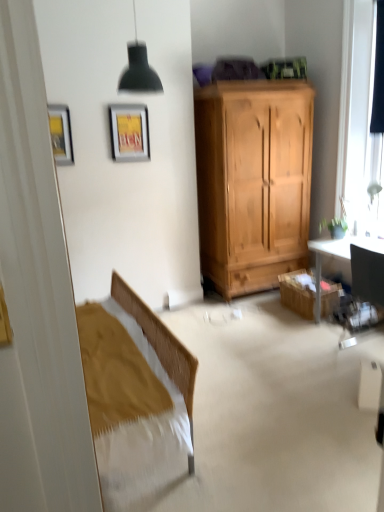
Question: Is wooden cabinet at lower right shorter than black fabric curtain at right?

Choices:
 (A) no
 (B) yes

Answer: (B)

Question: Can you confirm if wooden cabinet at lower right is positioned to the left of black fabric curtain at right?

Choices:
 (A) no
 (B) yes

Answer: (B)

Question: Is black fabric curtain at right located within wooden cabinet at lower right?

Choices:
 (A) no
 (B) yes

Answer: (A)

Question: Does wooden cabinet at lower right have a lesser width compared to black fabric curtain at right?

Choices:
 (A) no
 (B) yes

Answer: (A)

Question: Is wooden cabinet at lower right closer to camera compared to black fabric curtain at right?

Choices:
 (A) yes
 (B) no

Answer: (B)

Question: Choose the correct answer: Is matte black lampshade at upper center inside metallic silver picture frame at upper center, which appears as the second picture frame when viewed from the left, or outside it?

Choices:
 (A) inside
 (B) outside

Answer: (B)

Question: Considering the positions of point (153, 91) and point (135, 155), is point (153, 91) closer or farther from the camera than point (135, 155)?

Choices:
 (A) farther
 (B) closer

Answer: (B)

Question: From a real-world perspective, is matte black lampshade at upper center above or below metallic silver picture frame at upper center, which is the second picture frame from front to back?

Choices:
 (A) below
 (B) above

Answer: (B)

Question: Based on their sizes in the image, would you say matte black lampshade at upper center is bigger or smaller than metallic silver picture frame at upper center, arranged as the first picture frame when viewed from the back?

Choices:
 (A) big
 (B) small

Answer: (A)

Question: Is black fabric curtain at right to the left or to the right of wooden cabinet at lower right in the image?

Choices:
 (A) left
 (B) right

Answer: (B)

Question: Considering the positions of point (377, 47) and point (324, 294), is point (377, 47) closer or farther from the camera than point (324, 294)?

Choices:
 (A) farther
 (B) closer

Answer: (B)

Question: Considering the positions of black fabric curtain at right and wooden cabinet at lower right in the image, is black fabric curtain at right bigger or smaller than wooden cabinet at lower right?

Choices:
 (A) big
 (B) small

Answer: (B)

Question: From their relative heights in the image, would you say black fabric curtain at right is taller or shorter than wooden cabinet at lower right?

Choices:
 (A) short
 (B) tall

Answer: (B)

Question: Visually, is black fabric curtain at right positioned to the left or to the right of metallic silver picture frame at upper center, arranged as the first picture frame when viewed from the back?

Choices:
 (A) right
 (B) left

Answer: (A)

Question: In the image, is black fabric curtain at right positioned in front of or behind metallic silver picture frame at upper center, placed as the first picture frame when sorted from right to left?

Choices:
 (A) behind
 (B) front

Answer: (B)